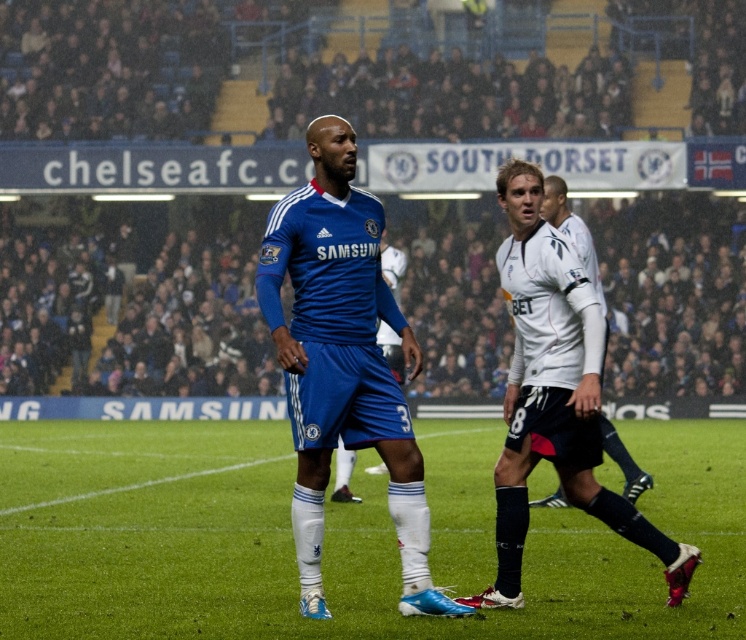
You are a sports analyst watching the soccer match. You notice two players in the center of the field wearing the blue jersey at center and the white smooth jersey at center. Which player has a larger jersey size?

The blue jersey at center is bigger than the white smooth jersey at center, so the player wearing the blue jersey at center has a larger jersey size.

You are a spectator at the soccer match and want to take a photo of both the white smooth jersey at center and the white jersey at center. Which one will appear larger in your camera view?

The white smooth jersey at center will appear larger in your camera view because it is closer to the viewer than the white jersey at center.

You are a soccer player standing at the center of the pitch. You see two points marked on the field, point 1 at coordinates (275, 248) and point 2 at (554, 221). Which point is closer to you?

Point 1 at coordinates (275, 248) is closer to you than point 2 at (554, 221).